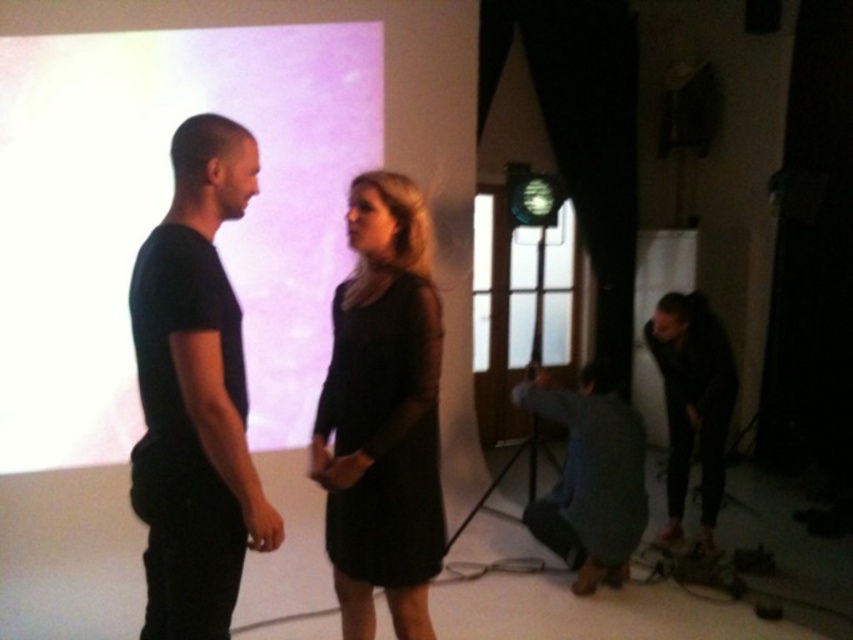
Which is behind, point (357, 337) or point (705, 381)?

Point (705, 381)

Who is positioned more to the left, black matte dress at center or black matte dress at lower right?

black matte dress at center

Find the location of `black matte dress at center`. black matte dress at center is located at coordinates (386, 435).

I want to click on black matte dress at center, so click(386, 435).

Does white matte projection screen at upper left have a greater width compared to black matte dress at lower right?

Indeed, white matte projection screen at upper left has a greater width compared to black matte dress at lower right.

You are a GUI agent. You are given a task and a screenshot of the screen. Output one action in this format:
    pyautogui.click(x=<x>, y=<y>)
    Task: Click on the white matte projection screen at upper left
    The height and width of the screenshot is (640, 853).
    Given the screenshot: What is the action you would take?
    pyautogui.click(x=164, y=212)

The height and width of the screenshot is (640, 853). I want to click on white matte projection screen at upper left, so click(x=164, y=212).

Who is more distant from viewer, (x=204, y=125) or (x=637, y=417)?

Positioned behind is point (x=637, y=417).

Based on the photo, does black matte t-shirt at left have a larger size compared to blue denim jeans at lower right?

Actually, black matte t-shirt at left might be smaller than blue denim jeans at lower right.

Is point (198, 582) positioned in front of point (537, 520)?

Yes, point (198, 582) is closer to viewer.

In order to click on black matte t-shirt at left in this screenshot , I will do `click(195, 394)`.